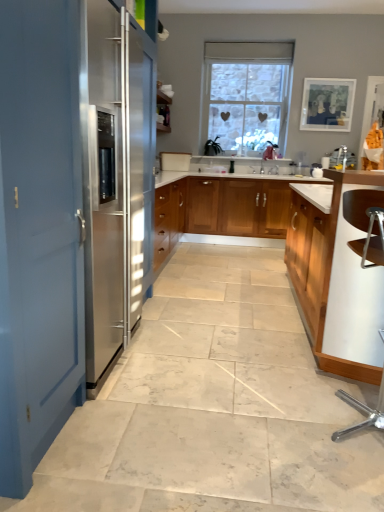
Question: Could you tell me if stone textured window at center is turned towards blue matte door at left?

Choices:
 (A) yes
 (B) no

Answer: (A)

Question: Is stone textured window at center smaller than blue matte door at left?

Choices:
 (A) no
 (B) yes

Answer: (B)

Question: Can you confirm if stone textured window at center is bigger than blue matte door at left?

Choices:
 (A) no
 (B) yes

Answer: (A)

Question: Does stone textured window at center have a lesser height compared to blue matte door at left?

Choices:
 (A) no
 (B) yes

Answer: (B)

Question: From the image's perspective, does stone textured window at center appear lower than blue matte door at left?

Choices:
 (A) yes
 (B) no

Answer: (B)

Question: From a real-world perspective, relative to light wood/wooden cabinet at right, which ranks as the 1th cabinetry in front-to-back order, is stone textured window at center vertically above or below?

Choices:
 (A) below
 (B) above

Answer: (B)

Question: Considering the positions of point click(x=233, y=114) and point click(x=294, y=239), is point click(x=233, y=114) closer or farther from the camera than point click(x=294, y=239)?

Choices:
 (A) closer
 (B) farther

Answer: (B)

Question: Is stone textured window at center bigger or smaller than light wood/wooden cabinet at right, arranged as the second cabinetry when viewed from the back?

Choices:
 (A) small
 (B) big

Answer: (A)

Question: Is stone textured window at center inside the boundaries of light wood/wooden cabinet at right, which ranks as the 1th cabinetry in front-to-back order, or outside?

Choices:
 (A) outside
 (B) inside

Answer: (A)

Question: Is point (377, 186) closer or farther from the camera than point (215, 201)?

Choices:
 (A) closer
 (B) farther

Answer: (A)

Question: Would you say light wood/wooden cabinet at right, which ranks as the 1th cabinetry in front-to-back order, is to the left or to the right of wooden cabinet at center, which is counted as the second cabinetry, starting from the front, in the picture?

Choices:
 (A) left
 (B) right

Answer: (B)

Question: Looking at the image, does light wood/wooden cabinet at right, arranged as the second cabinetry when viewed from the back, seem bigger or smaller compared to wooden cabinet at center, positioned as the first cabinetry in back-to-front order?

Choices:
 (A) big
 (B) small

Answer: (A)

Question: From the image's perspective, relative to wooden cabinet at center, positioned as the first cabinetry in back-to-front order, is light wood/wooden cabinet at right, which ranks as the 1th cabinetry in front-to-back order, above or below?

Choices:
 (A) below
 (B) above

Answer: (A)

Question: From the image's perspective, is blue matte door at left above or below wooden cabinet at center, which is counted as the second cabinetry, starting from the front?

Choices:
 (A) below
 (B) above

Answer: (A)

Question: Is blue matte door at left to the left or to the right of wooden cabinet at center, which is counted as the second cabinetry, starting from the front, in the image?

Choices:
 (A) left
 (B) right

Answer: (A)